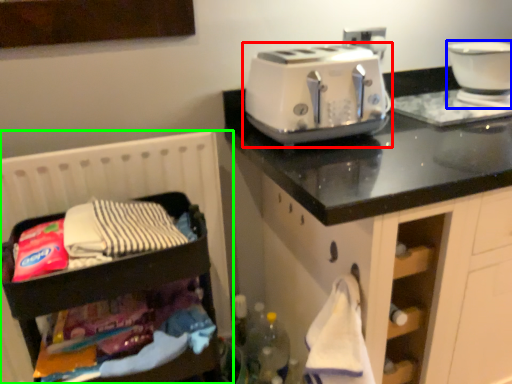
Question: Estimate the real-world distances between objects in this image. Which object is farther from toaster (highlighted by a red box), home appliance (highlighted by a blue box) or infant bed (highlighted by a green box)?

Choices:
 (A) home appliance
 (B) infant bed

Answer: (A)